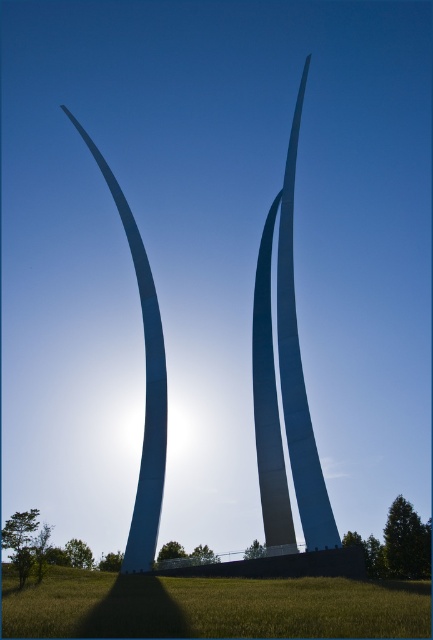
Is green grass at lower center bigger than white polished steel sculpture at center?

Incorrect, green grass at lower center is not larger than white polished steel sculpture at center.

Is point (190, 614) closer to viewer compared to point (332, 524)?

That is True.

I want to click on green grass at lower center, so click(x=210, y=605).

Who is positioned more to the left, green grass at lower center or white polished steel sculpture at left?

From the viewer's perspective, white polished steel sculpture at left appears more on the left side.

Can you confirm if green grass at lower center is positioned below white polished steel sculpture at left?

Indeed, green grass at lower center is positioned under white polished steel sculpture at left.

Which is in front, point (68, 616) or point (146, 500)?

Point (68, 616) is in front.

Image resolution: width=433 pixels, height=640 pixels. In order to click on green grass at lower center in this screenshot , I will do `click(210, 605)`.

Who is more forward, (319, 512) or (142, 497)?

Point (319, 512) is in front.

Based on the photo, who is positioned more to the right, white polished steel sculpture at center or white polished steel sculpture at left?

From the viewer's perspective, white polished steel sculpture at center appears more on the right side.

Who is more distant from viewer, [284,186] or [148,550]?

The point [284,186] is behind.

The image size is (433, 640). Find the location of `white polished steel sculpture at center`. white polished steel sculpture at center is located at coordinates (284, 385).